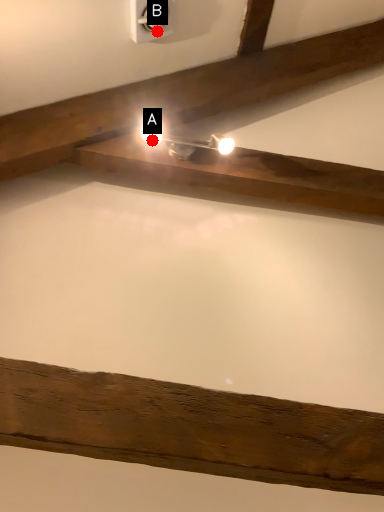
Question: Two points are circled on the image, labeled by A and B beside each circle. Which point is farther to the camera?

Choices:
 (A) A is further
 (B) B is further

Answer: (B)